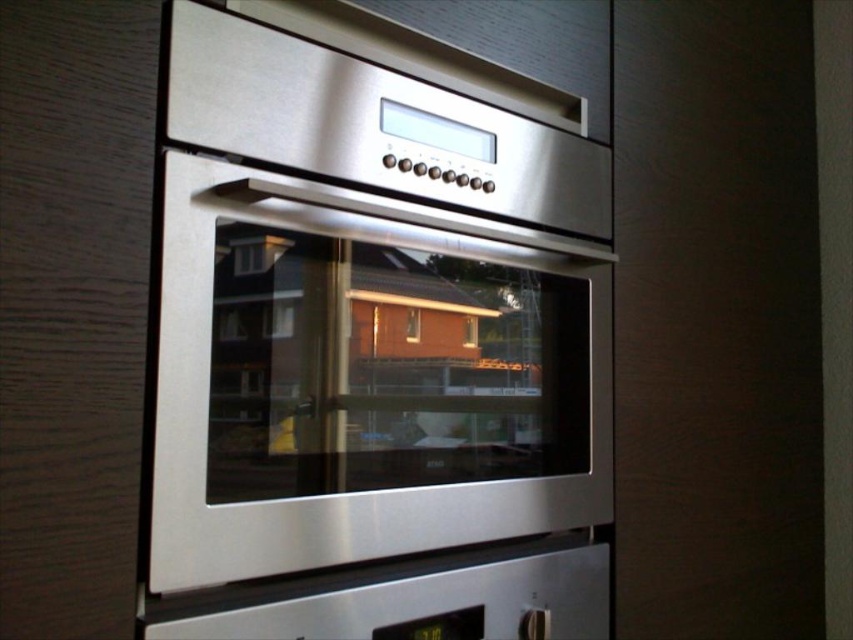
Question: Is the position of stainless steel oven at center more distant than that of satin metallic exhaust hood at upper center?

Choices:
 (A) no
 (B) yes

Answer: (A)

Question: Which object is farther from the camera taking this photo?

Choices:
 (A) satin metallic exhaust hood at upper center
 (B) stainless steel oven at center

Answer: (A)

Question: Observing the image, what is the correct spatial positioning of stainless steel oven at center in reference to satin metallic exhaust hood at upper center?

Choices:
 (A) above
 (B) below

Answer: (B)

Question: Does stainless steel oven at center come in front of satin metallic exhaust hood at upper center?

Choices:
 (A) yes
 (B) no

Answer: (A)

Question: Which object appears farthest from the camera in this image?

Choices:
 (A) stainless steel oven at center
 (B) satin metallic exhaust hood at upper center

Answer: (B)